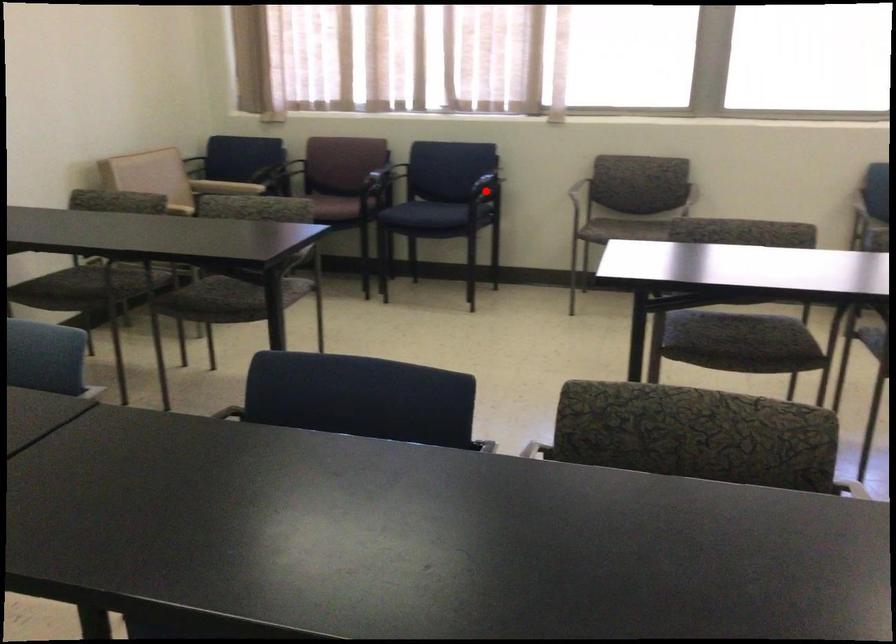
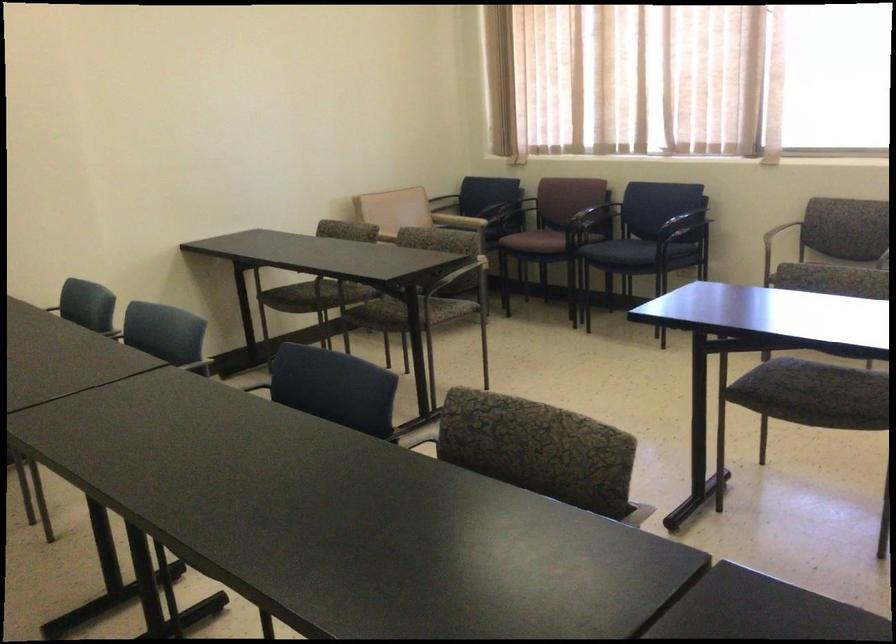
The point at the highlighted location is marked in the first image. Where is the corresponding point in the second image?

(687, 225)